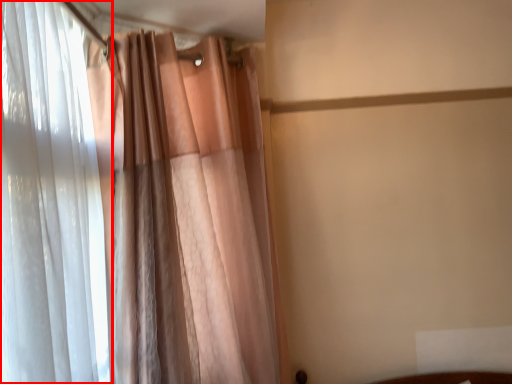
Question: Observing the image, what is the correct spatial positioning of curtain (annotated by the red box) in reference to curtain?

Choices:
 (A) left
 (B) right

Answer: (A)